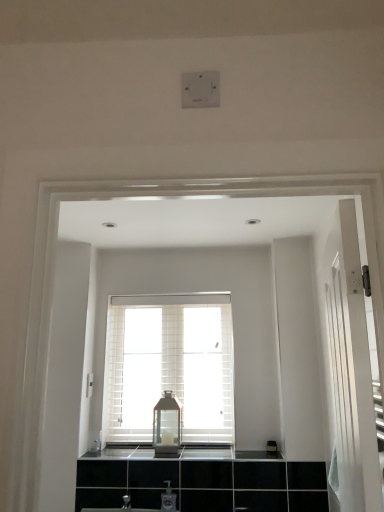
You are a GUI agent. You are given a task and a screenshot of the screen. Output one action in this format:
    pyautogui.click(x=<x>, y=<y>)
    Task: Click on the free space to the left of matte glass lantern at center
    
    Given the screenshot: What is the action you would take?
    coord(135,445)